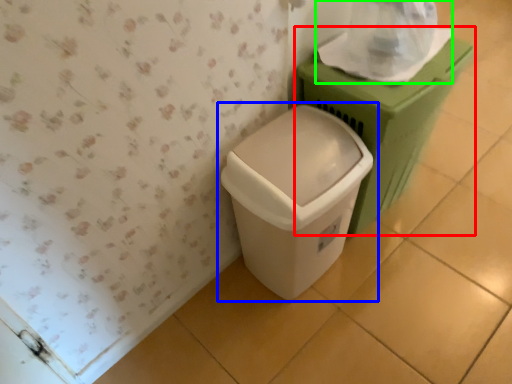
Question: Considering the real-world distances, which object is farthest from waste container (highlighted by a red box)? waste container (highlighted by a blue box) or toilet paper (highlighted by a green box)?

Choices:
 (A) waste container
 (B) toilet paper

Answer: (A)